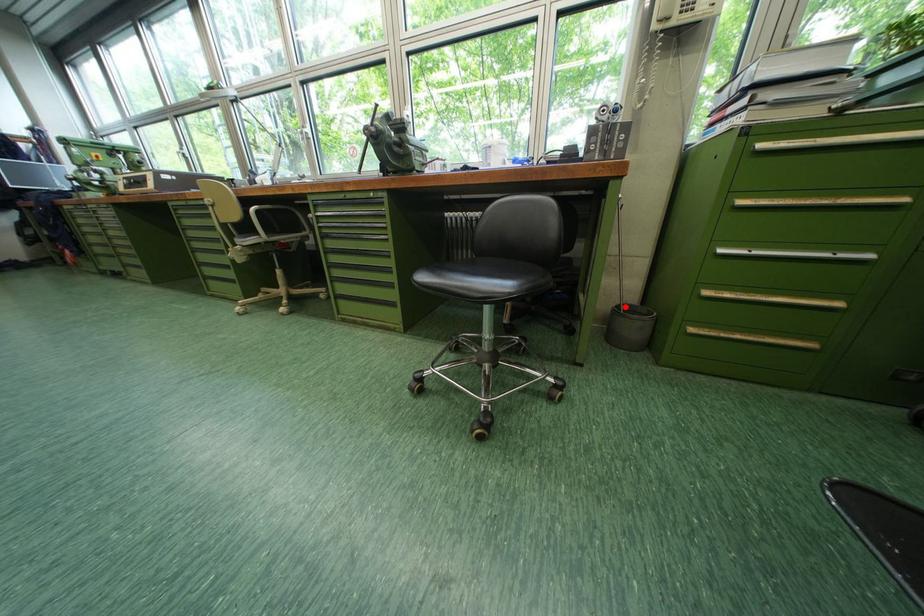
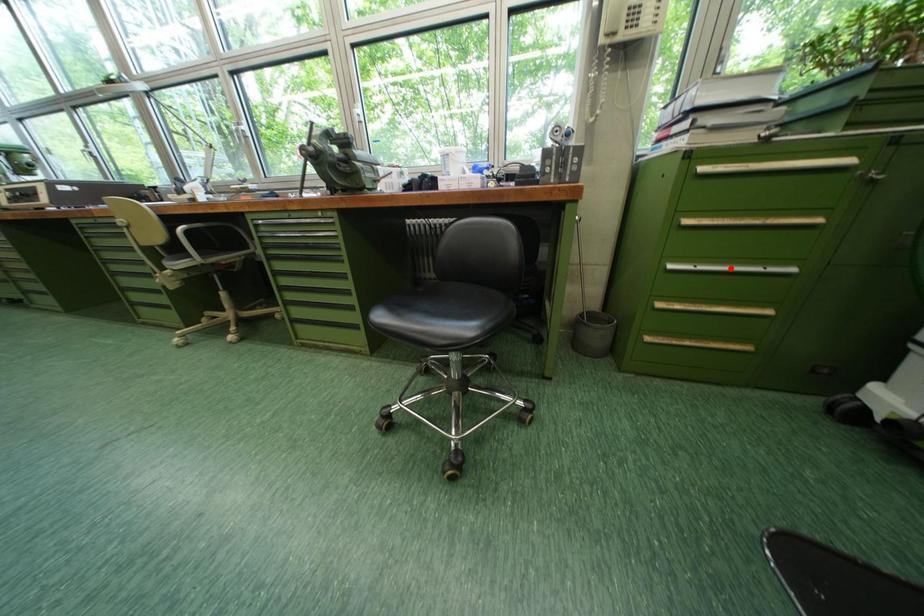
I am providing you with two images of the same scene from different viewpoints. A red point is marked on the first image and another point is marked on the second image. Is the red point in image1 aligned with the point shown in image2?

No